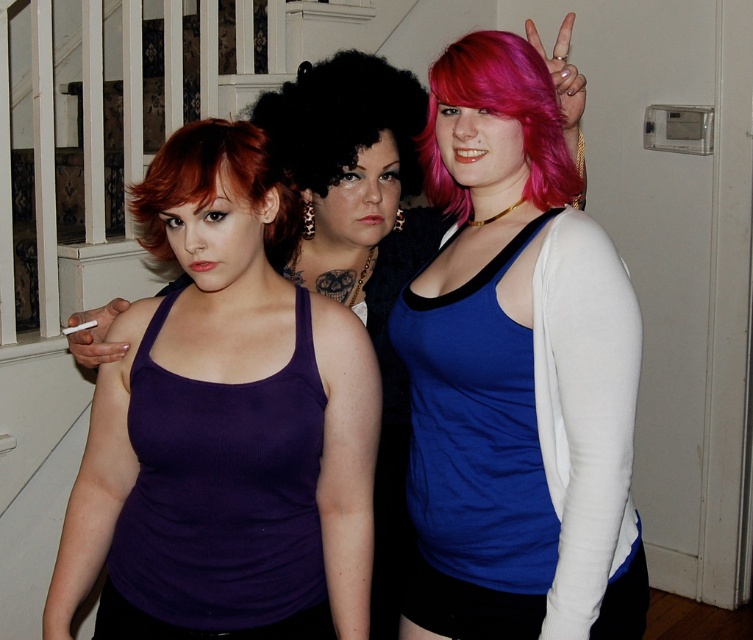
In the scene shown: You are a photographer setting up a camera to capture the scene. You need to ensure that the purple ribbed tank top at left and the pink matte hair at center are both in focus. Given their sizes, which object should you adjust the focus on first to ensure proper framing?

The purple ribbed tank top at left is wider than the pink matte hair at center, so you should focus on the purple ribbed tank top at left first to ensure proper framing.

You are a photographer standing 10 feet away from the subjects. You want to capture a closeup shot of both the purple ribbed tank top at left and the pink matte hair at center in the same frame. Given that your camera has a maximum focus range of 20 inches, will you be able to focus on both subjects simultaneously?

The purple ribbed tank top at left and the pink matte hair at center are 19.57 inches apart from each other. Since the distance between them is within the camera maximum focus range of 20 inches, you can focus on both subjects simultaneously.